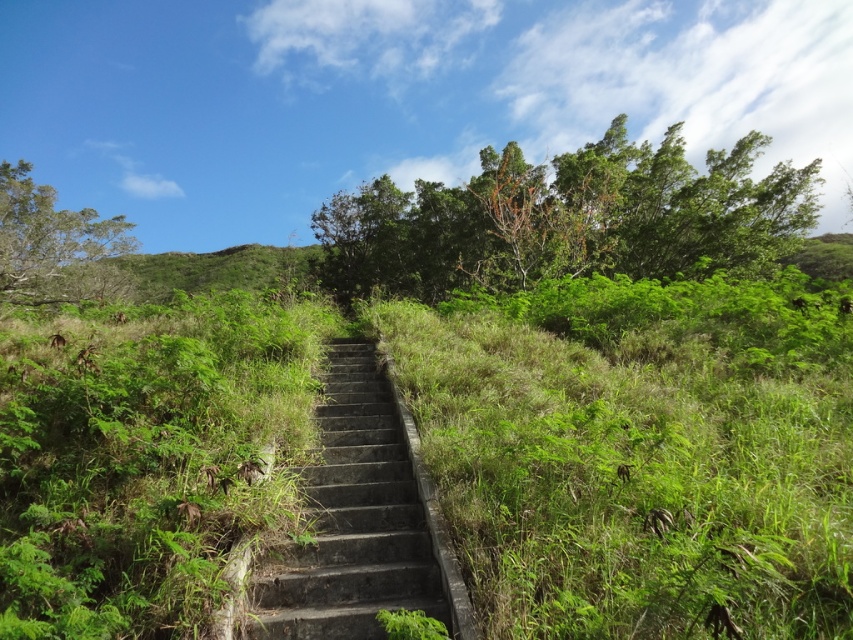
Consider the image. Who is lower down, green grassy at center or dark gray concrete stairs at center?

dark gray concrete stairs at center

Is point (502, 628) closer to viewer compared to point (398, 497)?

Yes, it is in front of point (398, 497).

Image resolution: width=853 pixels, height=640 pixels. Identify the location of green grassy at center. (640, 452).

Is green grassy at center thinner than green leafy bush at upper center?

Yes.

Which is in front, point (589, 352) or point (384, 216)?

Point (589, 352) is more forward.

Measure the distance between point (508, 323) and camera.

A distance of 8.08 meters exists between point (508, 323) and camera.

Locate an element on the screen. Image resolution: width=853 pixels, height=640 pixels. green grassy at center is located at coordinates 640,452.

Identify the location of green leafy bush at upper center. (567, 220).

This screenshot has height=640, width=853. I want to click on green leafy bush at upper center, so click(x=567, y=220).